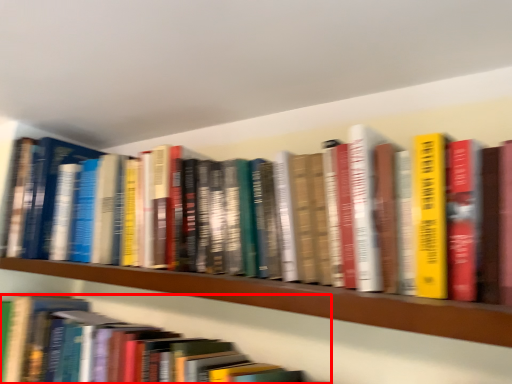
Question: From the image's perspective, what is the correct spatial positioning of book (annotated by the red box) in reference to shelf?

Choices:
 (A) above
 (B) below

Answer: (B)